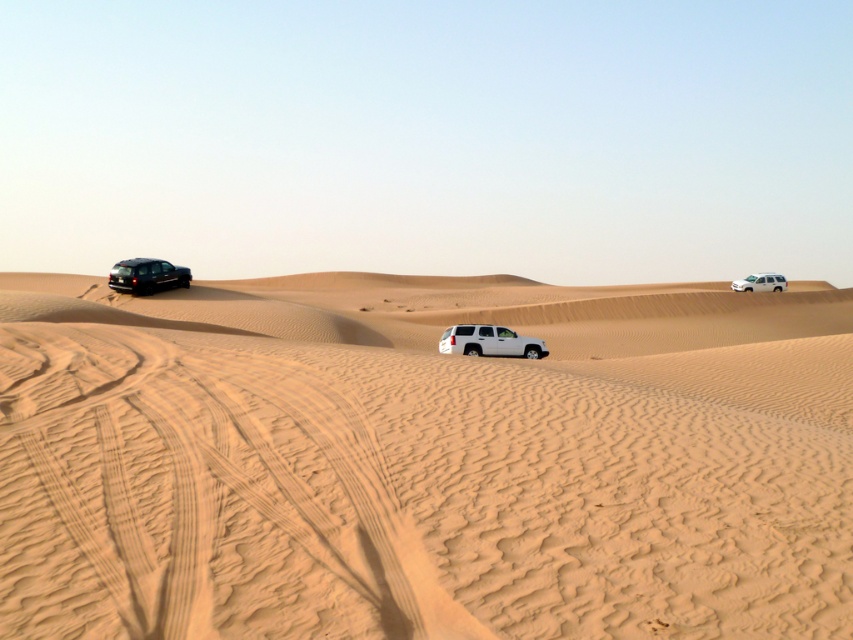
Question: Which of the following is the farthest from the observer?

Choices:
 (A) 184,276
 (B) 450,328

Answer: (A)

Question: Is smooth golden sand at center positioned before white matte suv at upper right?

Choices:
 (A) no
 (B) yes

Answer: (B)

Question: Does white matte suv at center lie behind white matte suv at upper right?

Choices:
 (A) yes
 (B) no

Answer: (B)

Question: Which object is closer to the camera taking this photo?

Choices:
 (A) white matte suv at upper right
 (B) smooth golden sand at center
 (C) white matte suv at center
 (D) shiny black suv at left

Answer: (B)

Question: Which point appears farthest from the camera in this image?

Choices:
 (A) (340, 600)
 (B) (519, 340)
 (C) (759, 291)
 (D) (123, 289)

Answer: (C)

Question: Is white matte suv at center positioned before white matte suv at upper right?

Choices:
 (A) no
 (B) yes

Answer: (B)